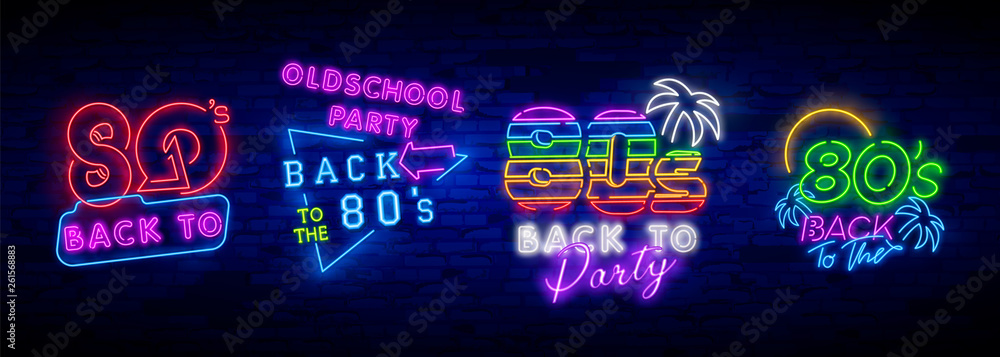
The height and width of the screenshot is (357, 1000). Find the location of `4 neon signs`. 4 neon signs is located at coordinates (162, 173), (359, 172), (597, 195), (873, 203).